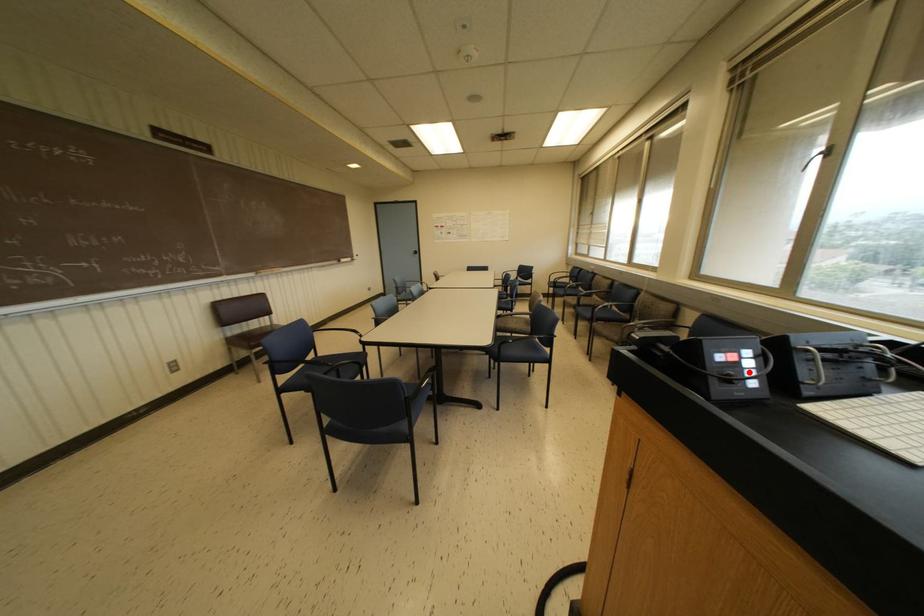
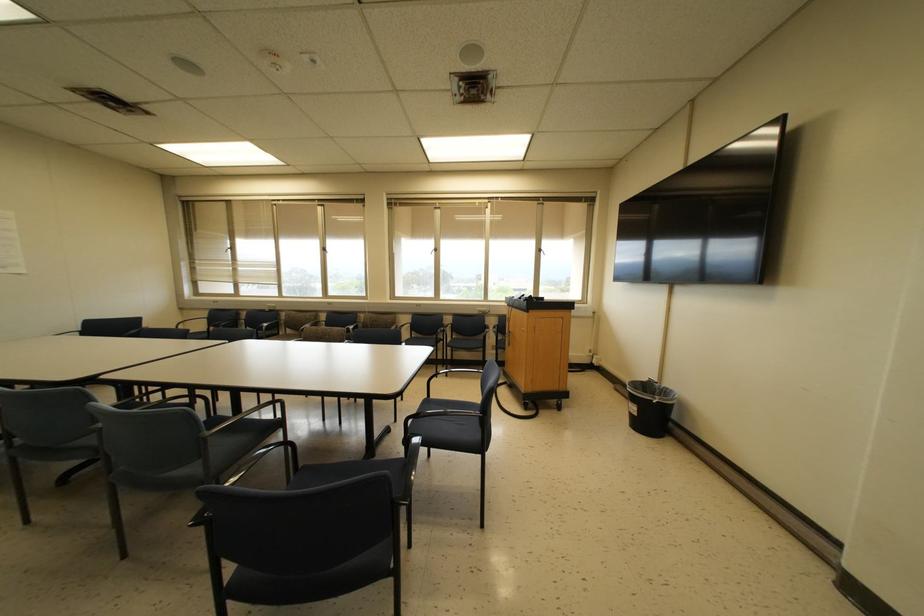
Question: I am providing you with two images of the same scene from different viewpoints. A red point is marked on the first image. Can you still see the location of the red point in image 2?

Choices:
 (A) Yes
 (B) No

Answer: (B)